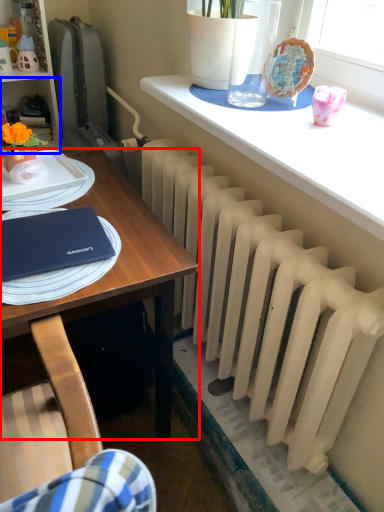
Question: Which object is closer to the camera taking this photo, desk (highlighted by a red box) or shelf (highlighted by a blue box)?

Choices:
 (A) desk
 (B) shelf

Answer: (A)